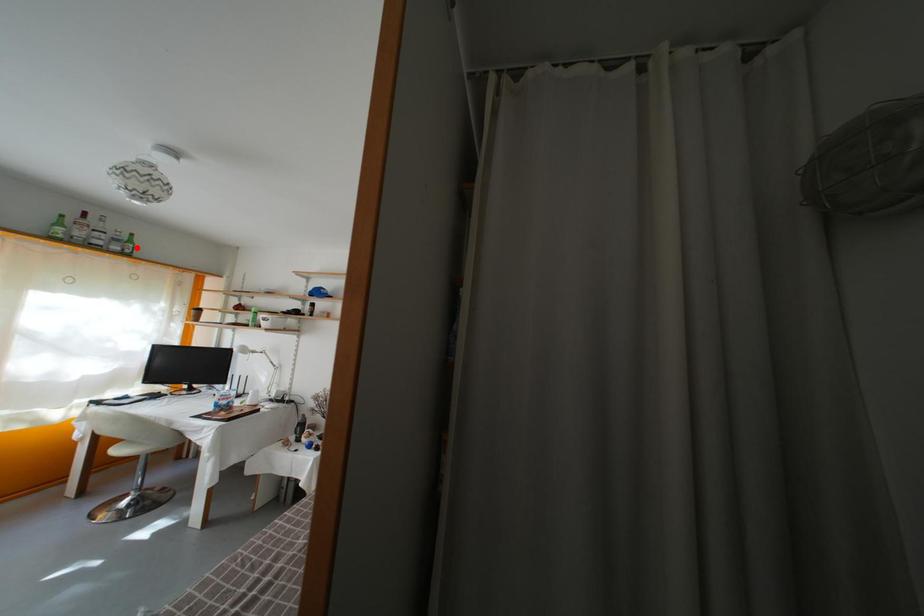
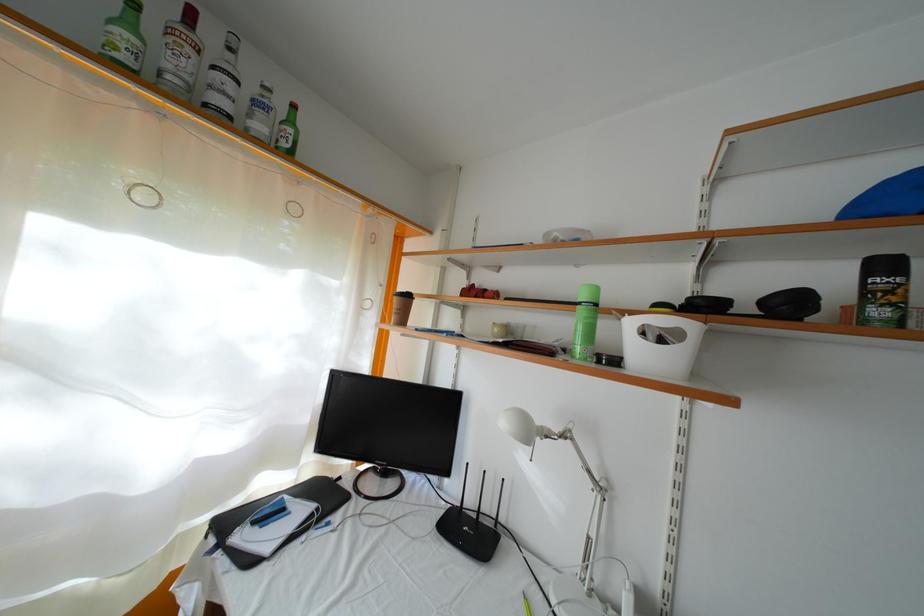
Where in the second image is the point corresponding to the highlighted location from the first image?

(297, 128)